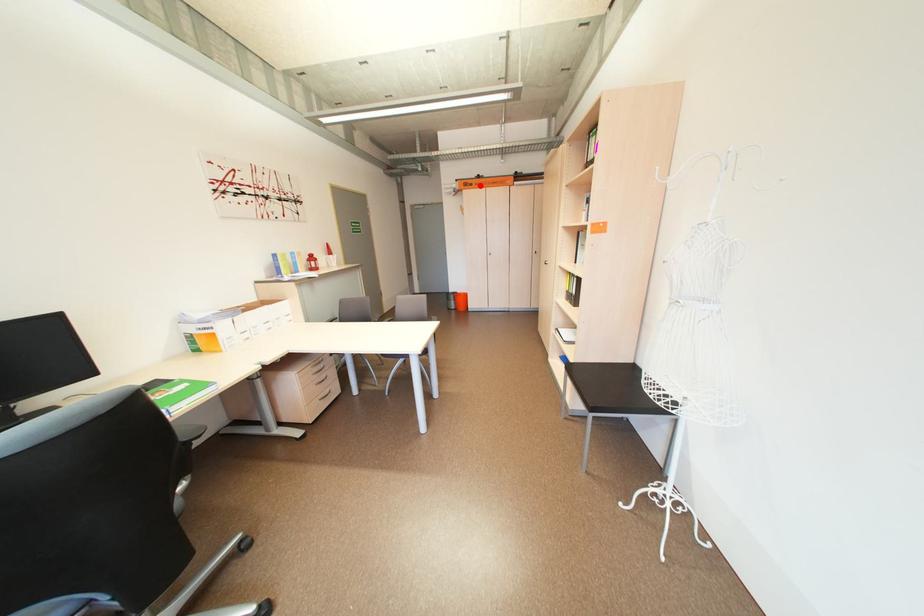
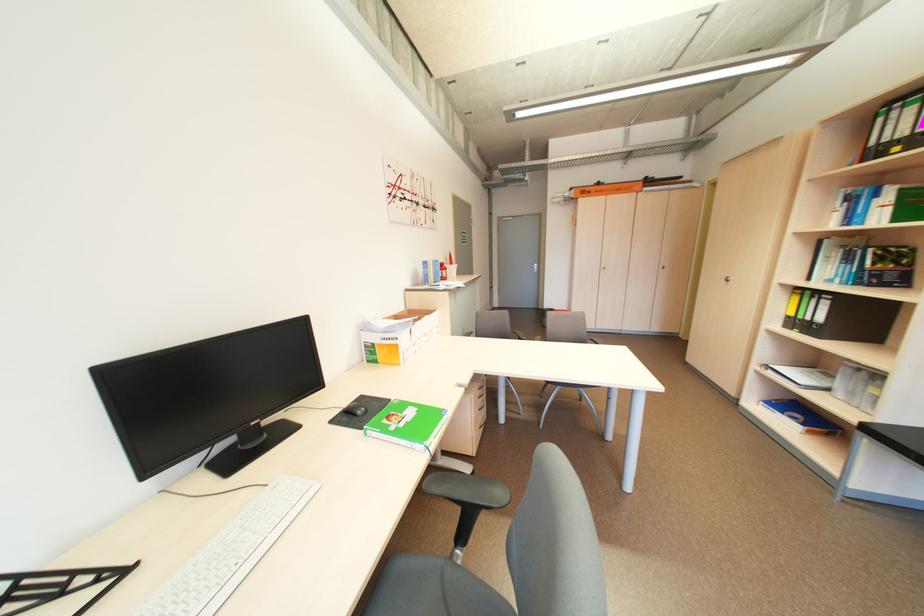
Locate, in the second image, the point that corresponds to the highlighted location in the first image.

(599, 193)